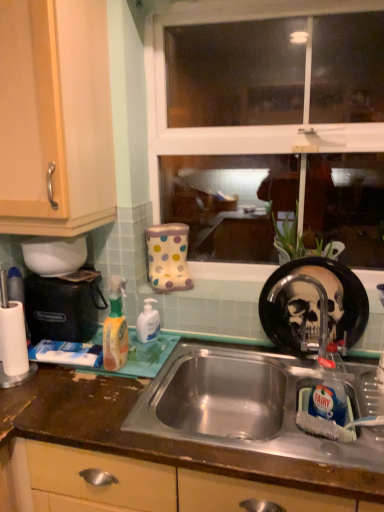
This screenshot has width=384, height=512. Identify the location of free space above black plastic coffee machine at left (from a real-world perspective). (68, 274).